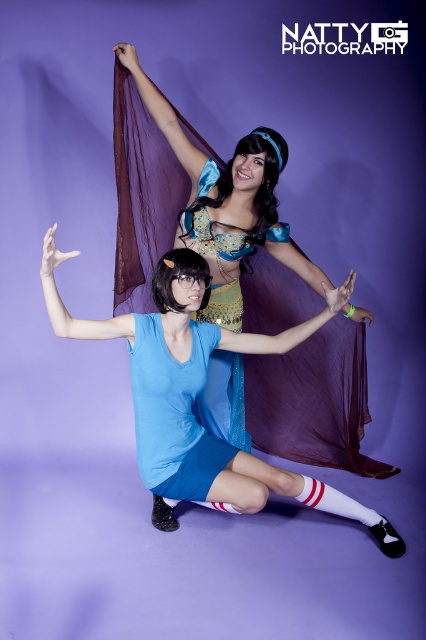
Is point (219, 493) behind point (183, 257)?

That is True.

Does matte blue dress at center appear under matte blue wig at center?

Yes.

Is point (55, 260) more distant than point (175, 264)?

No, (55, 260) is in front of (175, 264).

At what (x,y) coordinates should I click in order to perform the action: click on matte blue dress at center. Please return your answer as a coordinate pair (x, y). Looking at the image, I should click on (192, 416).

Can you confirm if blue satin dress at center is bigger than matte blue wig at center?

Correct, blue satin dress at center is larger in size than matte blue wig at center.

Between point (252, 134) and point (164, 308), which one is positioned in front?

Positioned in front is point (164, 308).

Locate an element on the screen. This screenshot has height=640, width=426. blue satin dress at center is located at coordinates (196, 225).

Based on the photo, which is more to the right, blue satin dress at center or matte blue dress at center?

matte blue dress at center is more to the right.

Does blue satin dress at center appear on the left side of matte blue dress at center?

Correct, you'll find blue satin dress at center to the left of matte blue dress at center.

This screenshot has width=426, height=640. In order to click on blue satin dress at center in this screenshot , I will do `click(196, 225)`.